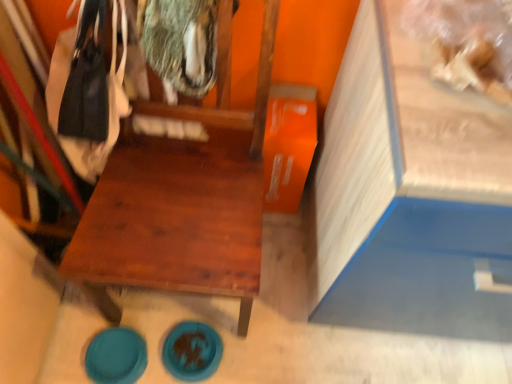
Question: Is wooden chair at center closer to the viewer compared to blue matte plate at lower center, which is counted as the 2th plate, starting from the left?

Choices:
 (A) yes
 (B) no

Answer: (A)

Question: From the image's perspective, does wooden chair at center appear lower than blue matte plate at lower center, which is counted as the 1th plate, starting from the right?

Choices:
 (A) no
 (B) yes

Answer: (A)

Question: From a real-world perspective, does wooden chair at center sit lower than blue matte plate at lower center, which is counted as the 1th plate, starting from the right?

Choices:
 (A) no
 (B) yes

Answer: (A)

Question: Is wooden chair at center far from blue matte plate at lower center, which is counted as the 1th plate, starting from the right?

Choices:
 (A) yes
 (B) no

Answer: (B)

Question: Is blue matte plate at lower center, which is counted as the 2th plate, starting from the left, surrounded by wooden chair at center?

Choices:
 (A) no
 (B) yes

Answer: (B)

Question: Is wooden chair at center bigger than blue matte plate at lower center, which is counted as the 2th plate, starting from the left?

Choices:
 (A) yes
 (B) no

Answer: (A)

Question: From a real-world perspective, is wooden chair at center on teal glossy plate at lower left, marked as the second plate in a right-to-left arrangement?

Choices:
 (A) yes
 (B) no

Answer: (A)

Question: Considering the relative sizes of wooden chair at center and teal glossy plate at lower left, which ranks as the 1th plate in left-to-right order, in the image provided, is wooden chair at center shorter than teal glossy plate at lower left, which ranks as the 1th plate in left-to-right order,?

Choices:
 (A) yes
 (B) no

Answer: (B)

Question: Considering the relative sizes of wooden chair at center and teal glossy plate at lower left, which ranks as the 1th plate in left-to-right order, in the image provided, is wooden chair at center taller than teal glossy plate at lower left, which ranks as the 1th plate in left-to-right order,?

Choices:
 (A) yes
 (B) no

Answer: (A)

Question: Does wooden chair at center come in front of teal glossy plate at lower left, marked as the second plate in a right-to-left arrangement?

Choices:
 (A) yes
 (B) no

Answer: (A)

Question: Is wooden chair at center positioned behind teal glossy plate at lower left, which ranks as the 1th plate in left-to-right order?

Choices:
 (A) yes
 (B) no

Answer: (B)

Question: Does wooden chair at center have a larger size compared to teal glossy plate at lower left, which ranks as the 1th plate in left-to-right order?

Choices:
 (A) no
 (B) yes

Answer: (B)

Question: From a real-world perspective, is teal glossy plate at lower left, marked as the second plate in a right-to-left arrangement, on blue matte plate at lower center, which is counted as the 1th plate, starting from the right?

Choices:
 (A) yes
 (B) no

Answer: (B)